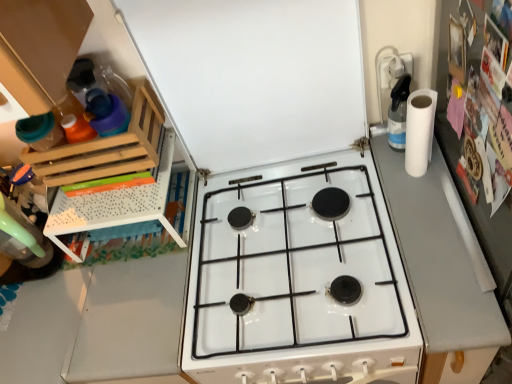
Question: From a real-world perspective, is white matte exhaust hood at upper center physically below wooden rack at left?

Choices:
 (A) no
 (B) yes

Answer: (B)

Question: Is white matte exhaust hood at upper center bigger than wooden rack at left?

Choices:
 (A) yes
 (B) no

Answer: (A)

Question: Is white matte exhaust hood at upper center smaller than wooden rack at left?

Choices:
 (A) yes
 (B) no

Answer: (B)

Question: Does white matte exhaust hood at upper center have a lesser width compared to wooden rack at left?

Choices:
 (A) no
 (B) yes

Answer: (B)

Question: From the image's perspective, would you say white matte exhaust hood at upper center is shown under wooden rack at left?

Choices:
 (A) no
 (B) yes

Answer: (A)

Question: Is gray matte counter top at right taller or shorter than white matte exhaust hood at upper center?

Choices:
 (A) short
 (B) tall

Answer: (B)

Question: From the image's perspective, is gray matte counter top at right above or below white matte exhaust hood at upper center?

Choices:
 (A) above
 (B) below

Answer: (B)

Question: In terms of width, does gray matte counter top at right look wider or thinner when compared to white matte exhaust hood at upper center?

Choices:
 (A) thin
 (B) wide

Answer: (B)

Question: Does point (x=395, y=188) appear closer or farther from the camera than point (x=202, y=29)?

Choices:
 (A) closer
 (B) farther

Answer: (B)

Question: Considering the positions of point (404, 117) and point (105, 175), is point (404, 117) closer or farther from the camera than point (105, 175)?

Choices:
 (A) farther
 (B) closer

Answer: (A)

Question: Would you say clear plastic spray bottle at upper right is to the left or to the right of wooden rack at left in the picture?

Choices:
 (A) left
 (B) right

Answer: (B)

Question: Relative to wooden rack at left, is clear plastic spray bottle at upper right in front or behind?

Choices:
 (A) behind
 (B) front

Answer: (A)

Question: Considering the positions of clear plastic spray bottle at upper right and wooden rack at left in the image, is clear plastic spray bottle at upper right taller or shorter than wooden rack at left?

Choices:
 (A) short
 (B) tall

Answer: (B)

Question: From the image's perspective, relative to white glossy gas stove at center, is gray matte counter top at right above or below?

Choices:
 (A) below
 (B) above

Answer: (A)

Question: In terms of size, does gray matte counter top at right appear bigger or smaller than white glossy gas stove at center?

Choices:
 (A) big
 (B) small

Answer: (A)